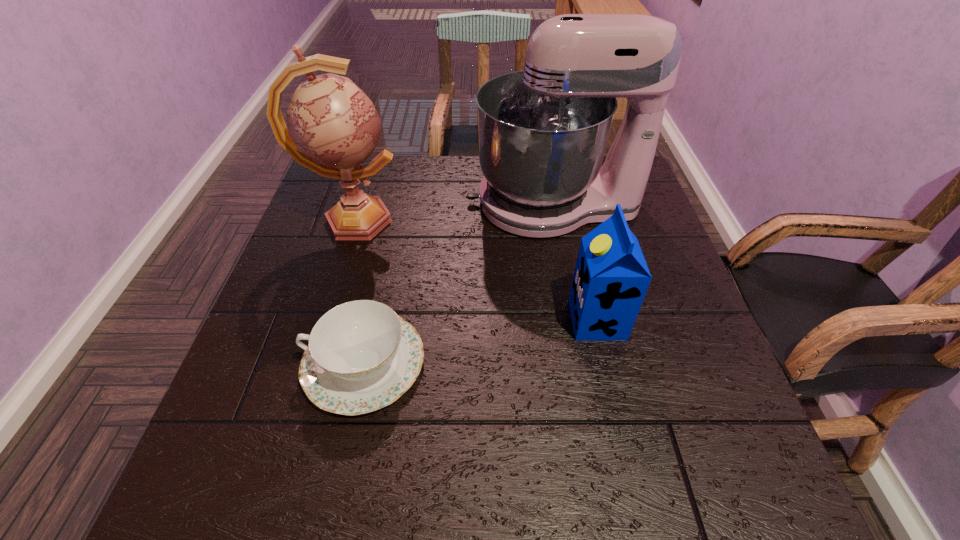
Find the location of a particular element. This screenshot has width=960, height=540. vacant space situated with the cap open on the third tallest object is located at coordinates [x=542, y=320].

Identify the location of vacant point located on the handle side of the shortest object. The image size is (960, 540). (262, 363).

This screenshot has height=540, width=960. What are the coordinates of `free space located on the handle side of the shortest object` in the screenshot? It's located at (x=247, y=363).

This screenshot has width=960, height=540. What are the coordinates of `mixer that is at the far edge` in the screenshot? It's located at (542, 132).

Where is `globe that is at the far edge`? The height and width of the screenshot is (540, 960). globe that is at the far edge is located at coordinates (333, 127).

The width and height of the screenshot is (960, 540). I want to click on globe at the left edge, so click(333, 127).

The image size is (960, 540). I want to click on chinaware that is at the left edge, so click(361, 356).

I want to click on mixer at the right edge, so click(542, 132).

Identify the location of carton located in the right edge section of the desktop. The image size is (960, 540). (611, 278).

The width and height of the screenshot is (960, 540). What are the coordinates of `object that is at the far left corner` in the screenshot? It's located at (333, 127).